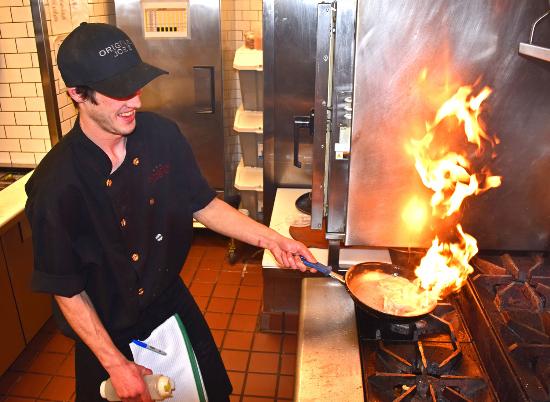
Find the location of a particular element. tile floor is located at coordinates (255, 337).